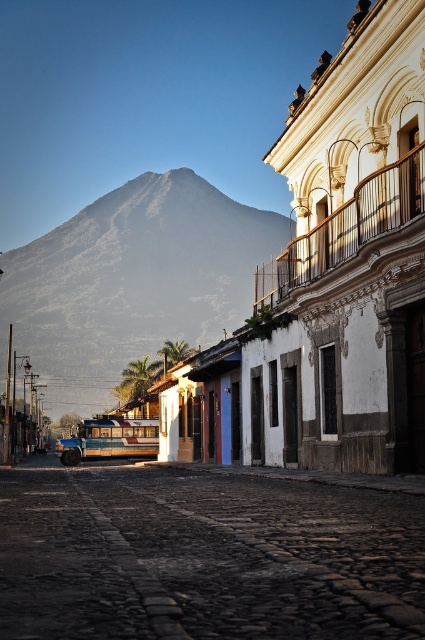
You are standing on the cobblestone street at center and want to take a photo of the gray rocky mountain at upper left. Which object is closer to you when you point your camera upwards?

The cobblestone street at center is closer to the viewer than the gray rocky mountain at upper left, so when pointing the camera upwards, the mountain is farther away and the street is closer.

You are a delivery truck driver who needs to drive through the cobblestone street at center. There is a wooden painted bus at center parked on the street. Can your truck fit through the space between the bus and the buildings on the right?

The cobblestone street at center is thinner than the wooden painted bus at center, so the truck may not fit through the space if the bus is parked in the middle of the street.

You are standing at the starting point of the cobblestone street in the small town scene. There are two points marked on the path ahead of you. One is at coordinates point (254, 216) and the other is at point (84, 452). Which of these two points is closer to the majestic mountain in the background?

Point (254, 216) is behind point (84, 452), so the point closer to the majestic mountain in the background is point (254, 216).